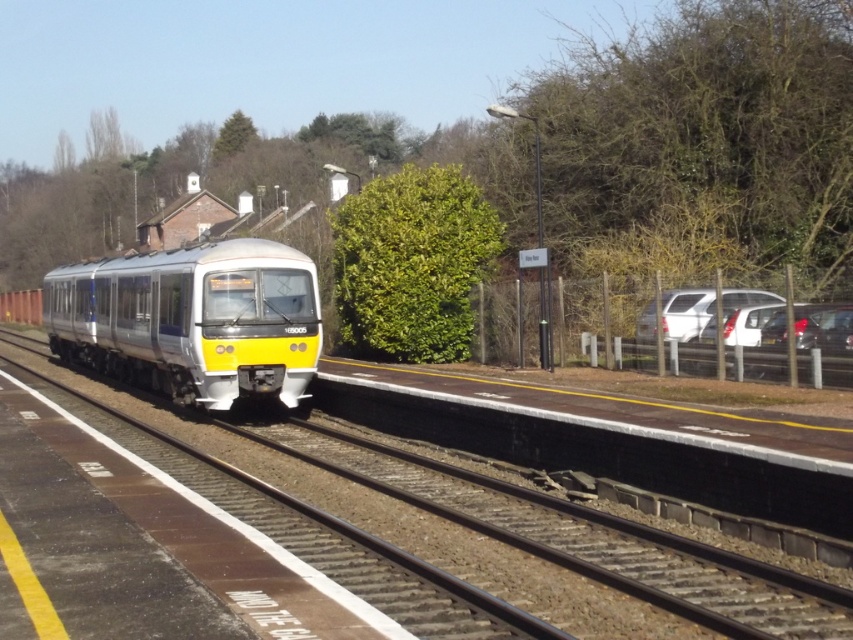
Based on the photo, you are a passenger waiting on the platform at the railway station. You notice the silver metallic train at center and the smooth metal train track at center. Which object is higher in height?

The silver metallic train at center is taller than the smooth metal train track at center.

You are a passenger waiting on the platform. You see the silver metallic train at center and the smooth metal train track at center. Which object is closer to you?

The silver metallic train at center is closer to you because the smooth metal train track at center is behind it.

You are a passenger waiting on the platform at the railway station. You see the silver metallic train at center and the smooth metal train track at center. Which object is closer to the left edge of the platform?

The silver metallic train at center is positioned on the left side of smooth metal train track at center, so it is closer to the left edge of the platform.